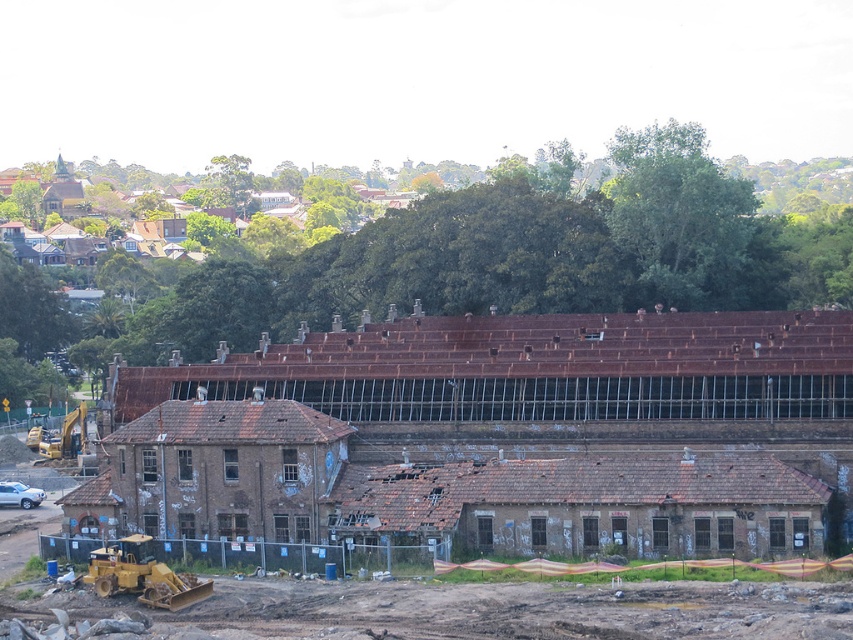
Question: Can you confirm if yellow rubber bulldozer at lower left is positioned to the left of yellow metallic excavator at lower left?

Choices:
 (A) no
 (B) yes

Answer: (A)

Question: Which object appears closest to the camera in this image?

Choices:
 (A) yellow rubber bulldozer at lower left
 (B) yellow metallic excavator at lower left

Answer: (A)

Question: Is yellow rubber bulldozer at lower left thinner than yellow metallic excavator at lower left?

Choices:
 (A) no
 (B) yes

Answer: (B)

Question: Is yellow rubber bulldozer at lower left positioned before yellow metallic excavator at lower left?

Choices:
 (A) yes
 (B) no

Answer: (A)

Question: Which point is farther to the camera?

Choices:
 (A) yellow rubber bulldozer at lower left
 (B) yellow metallic excavator at lower left

Answer: (B)